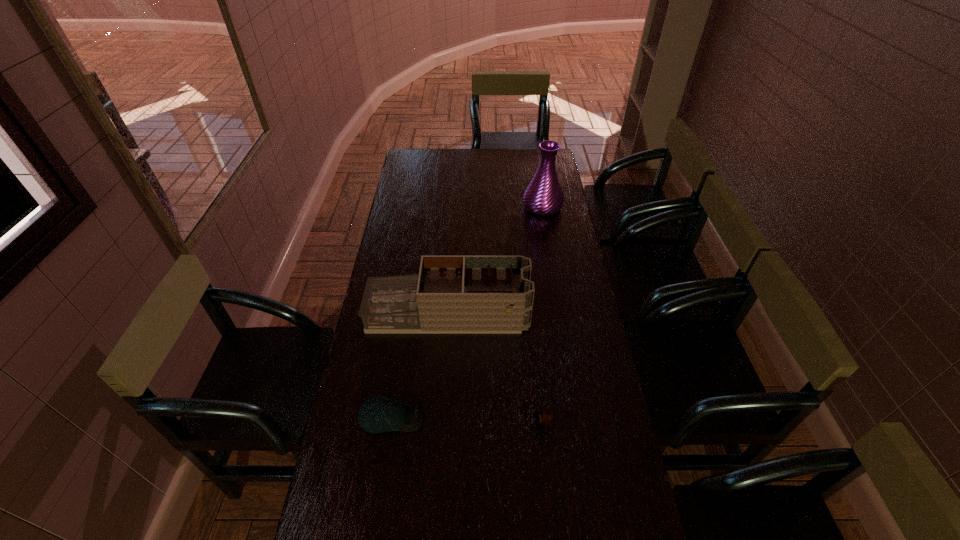
Where is `vase`? This screenshot has height=540, width=960. vase is located at coordinates (543, 196).

Locate an element on the screen. The image size is (960, 540). the farthest object is located at coordinates (543, 196).

Where is `dollhouse`? The height and width of the screenshot is (540, 960). dollhouse is located at coordinates (451, 294).

This screenshot has width=960, height=540. What are the coordinates of `the second farthest object` in the screenshot? It's located at (451, 294).

I want to click on teddy bear, so click(x=545, y=416).

Where is `baseball cap`? baseball cap is located at coordinates (379, 414).

Locate an element on the screen. This screenshot has height=540, width=960. free region located 0.110m on the back of the tallest object is located at coordinates (539, 183).

Locate an element on the screen. free space located at the entrance of the third shortest object is located at coordinates (550, 315).

Identify the location of free region located 0.250m on the front-facing side of the teddy bear. The width and height of the screenshot is (960, 540). [451, 423].

Find the location of `vacant space located on the front-facing side of the teddy bear`. vacant space located on the front-facing side of the teddy bear is located at coordinates (434, 423).